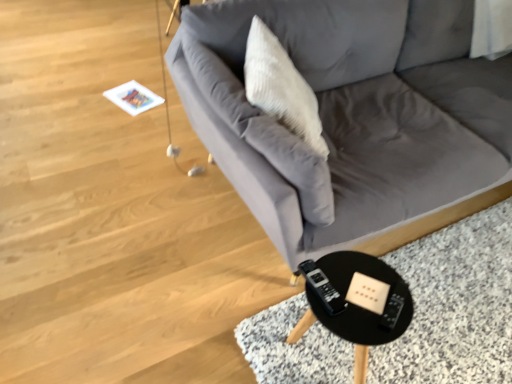
Question: Can you confirm if gray fabric couch at center is taller than black plastic table at lower right?

Choices:
 (A) yes
 (B) no

Answer: (A)

Question: Is gray fabric couch at center smaller than black plastic table at lower right?

Choices:
 (A) no
 (B) yes

Answer: (A)

Question: Is gray fabric couch at center closer to camera compared to black plastic table at lower right?

Choices:
 (A) no
 (B) yes

Answer: (B)

Question: Considering the relative positions of gray fabric couch at center and black plastic table at lower right in the image provided, is gray fabric couch at center behind black plastic table at lower right?

Choices:
 (A) no
 (B) yes

Answer: (A)

Question: From a real-world perspective, is gray fabric couch at center physically above black plastic table at lower right?

Choices:
 (A) no
 (B) yes

Answer: (B)

Question: Can you confirm if gray fabric couch at center is thinner than black plastic table at lower right?

Choices:
 (A) no
 (B) yes

Answer: (A)

Question: Is white textured pillow at upper center placed right next to gray fabric couch at center?

Choices:
 (A) no
 (B) yes

Answer: (A)

Question: Does white textured pillow at upper center appear on the left side of gray fabric couch at center?

Choices:
 (A) yes
 (B) no

Answer: (A)

Question: From a real-world perspective, is white textured pillow at upper center on top of gray fabric couch at center?

Choices:
 (A) no
 (B) yes

Answer: (B)

Question: Does white textured pillow at upper center appear on the right side of gray fabric couch at center?

Choices:
 (A) no
 (B) yes

Answer: (A)

Question: Can you confirm if white textured pillow at upper center is taller than gray fabric couch at center?

Choices:
 (A) no
 (B) yes

Answer: (A)

Question: Is white textured pillow at upper center not close to gray fabric couch at center?

Choices:
 (A) no
 (B) yes

Answer: (A)

Question: Can you confirm if black plastic table at lower right is shorter than gray fabric couch at center?

Choices:
 (A) yes
 (B) no

Answer: (A)